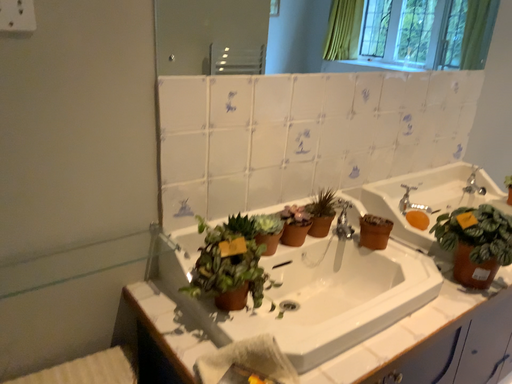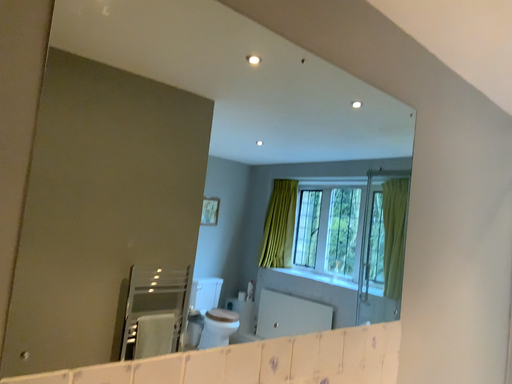
Question: Which way did the camera rotate in the video?

Choices:
 (A) rotated upward
 (B) rotated downward

Answer: (A)